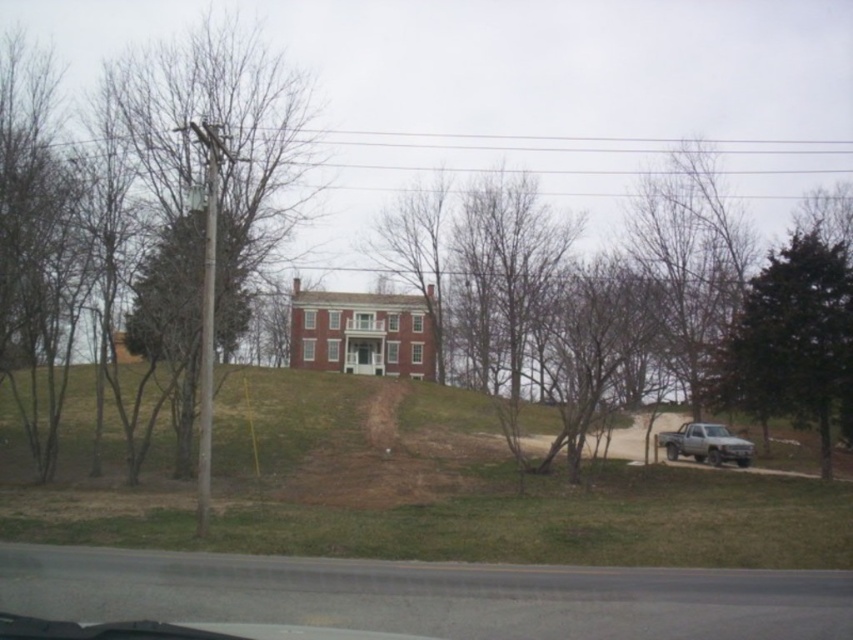
Question: Which point is farther to the camera?

Choices:
 (A) (799, 292)
 (B) (764, 328)
 (C) (660, 468)

Answer: (C)

Question: Does green grassy at lower center appear on the right side of green leafy tree at right?

Choices:
 (A) no
 (B) yes

Answer: (A)

Question: Is bare branches at center to the right of silver metallic truck at lower right from the viewer's perspective?

Choices:
 (A) yes
 (B) no

Answer: (A)

Question: Among these points, which one is farthest from the camera?

Choices:
 (A) (119, 528)
 (B) (817, 342)
 (C) (749, 451)
 (D) (659, 262)

Answer: (D)

Question: Can you confirm if green leafy tree at right is positioned above silver metallic truck at lower right?

Choices:
 (A) yes
 (B) no

Answer: (A)

Question: Which of the following is the closest to the observer?

Choices:
 (A) (582, 416)
 (B) (682, 445)

Answer: (A)